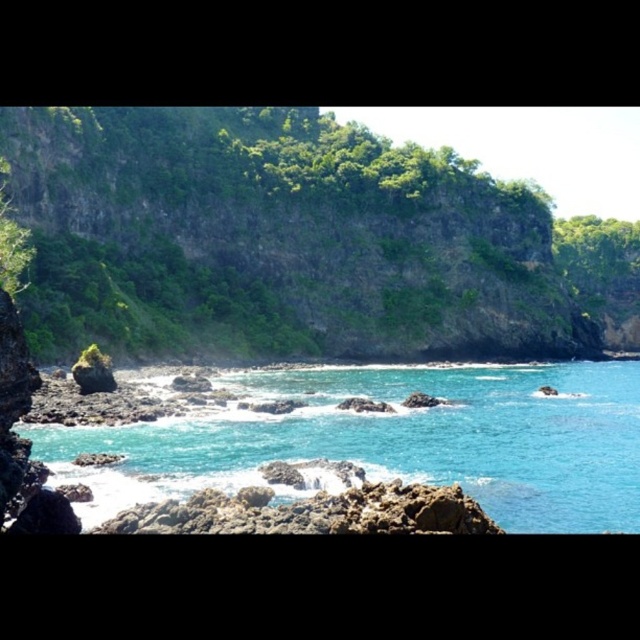
Question: Which point is closer to the camera taking this photo?

Choices:
 (A) (476, 465)
 (B) (337, 204)

Answer: (A)

Question: Which object is closer to the camera taking this photo?

Choices:
 (A) green rocky cliff at upper center
 (B) turquoise glossy water at center

Answer: (B)

Question: Which of the following is the closest to the observer?

Choices:
 (A) (513, 221)
 (B) (67, 442)

Answer: (B)

Question: Where is green rocky cliff at upper center located in relation to turquoise glossy water at center in the image?

Choices:
 (A) right
 (B) left

Answer: (A)

Question: Does green rocky cliff at upper center appear on the right side of turquoise glossy water at center?

Choices:
 (A) no
 (B) yes

Answer: (B)

Question: In this image, where is green rocky cliff at upper center located relative to turquoise glossy water at center?

Choices:
 (A) left
 (B) right

Answer: (B)